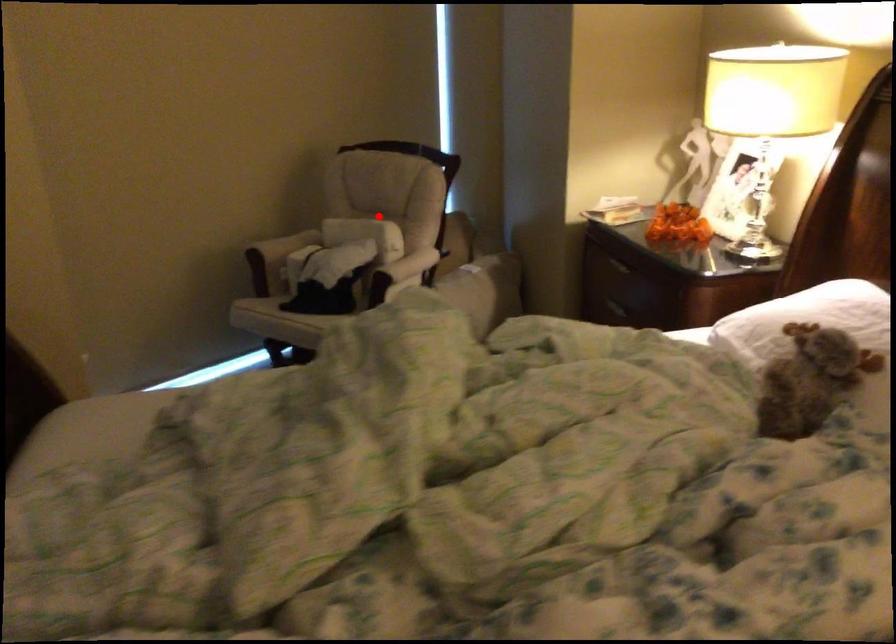
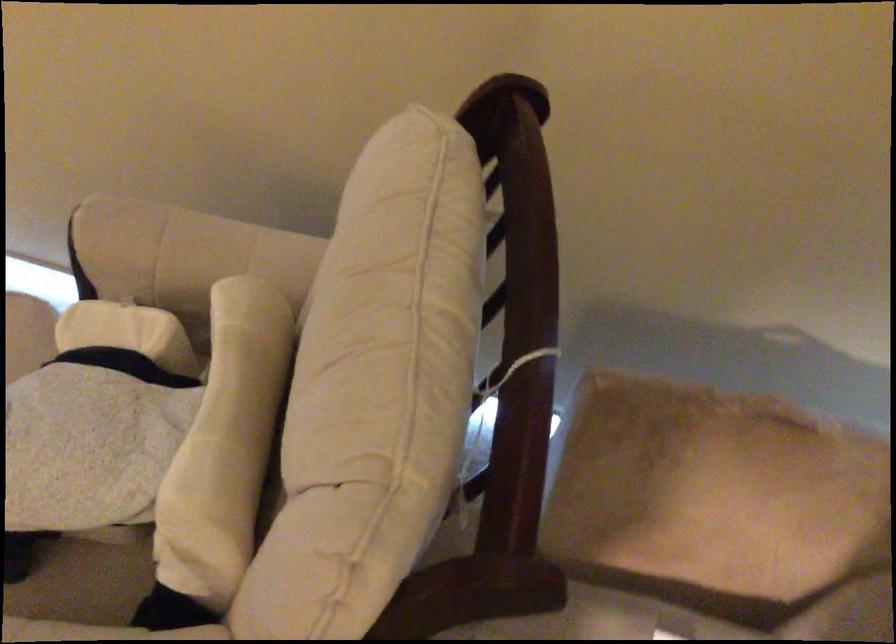
Where in the second image is the point corresponding to the highlighted location from the first image?

(225, 444)